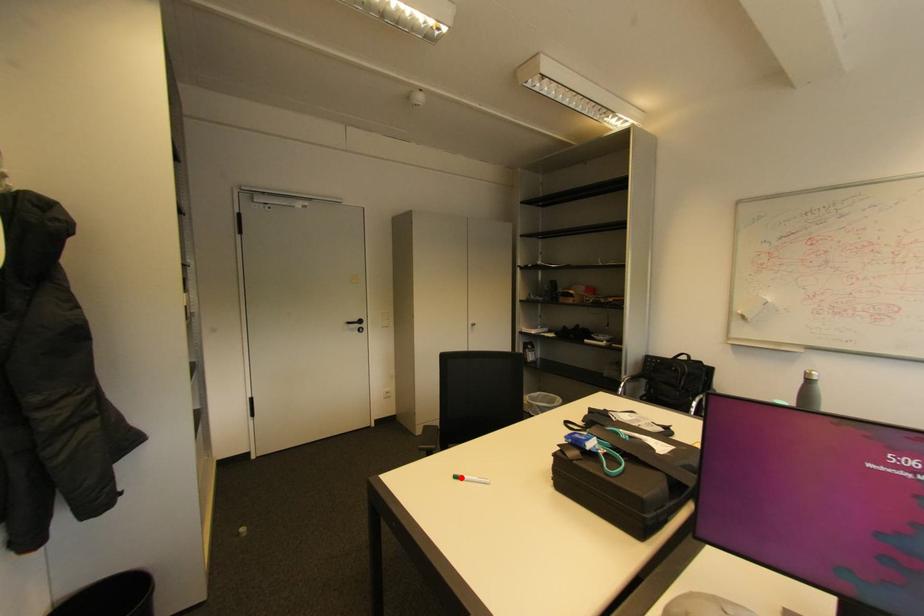
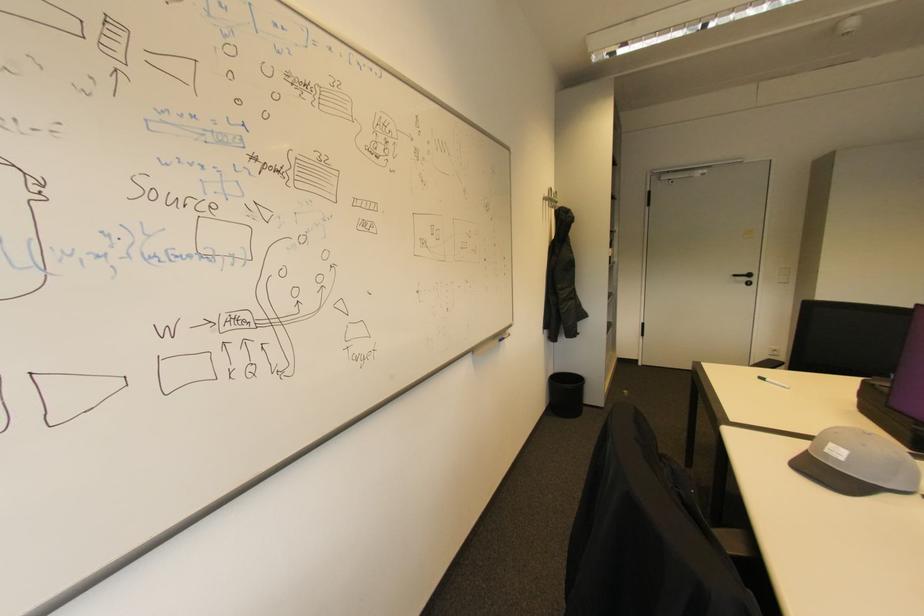
Where in the second image is the point corresponding to the highlighted location from the first image?

(768, 379)